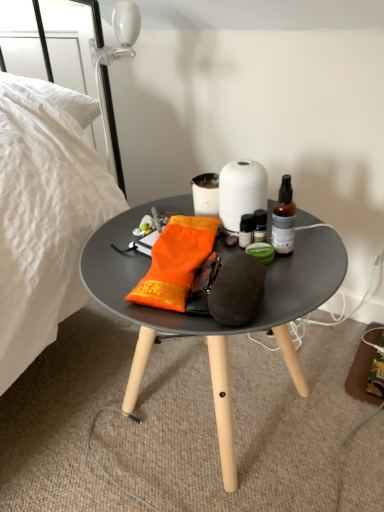
Question: Is orange fabric pouch at center oriented away from matte gray coffee table at center?

Choices:
 (A) yes
 (B) no

Answer: (B)

Question: Considering the relative positions of orange fabric pouch at center and matte gray coffee table at center in the image provided, is orange fabric pouch at center to the left of matte gray coffee table at center from the viewer's perspective?

Choices:
 (A) yes
 (B) no

Answer: (A)

Question: Is matte gray coffee table at center inside orange fabric pouch at center?

Choices:
 (A) yes
 (B) no

Answer: (B)

Question: Does orange fabric pouch at center have a greater height compared to matte gray coffee table at center?

Choices:
 (A) yes
 (B) no

Answer: (B)

Question: Is the depth of orange fabric pouch at center less than that of matte gray coffee table at center?

Choices:
 (A) yes
 (B) no

Answer: (B)

Question: In terms of height, does white matte vase at center look taller or shorter compared to matte gray coffee table at center?

Choices:
 (A) tall
 (B) short

Answer: (B)

Question: Which is correct: white matte vase at center is inside matte gray coffee table at center, or outside of it?

Choices:
 (A) outside
 (B) inside

Answer: (A)

Question: Visually, is white matte vase at center positioned to the left or to the right of matte gray coffee table at center?

Choices:
 (A) left
 (B) right

Answer: (B)

Question: From a real-world perspective, is white matte vase at center positioned above or below matte gray coffee table at center?

Choices:
 (A) below
 (B) above

Answer: (B)

Question: From a real-world perspective, is white matte vase at center above or below orange fabric pouch at center?

Choices:
 (A) below
 (B) above

Answer: (B)

Question: From the image's perspective, is white matte vase at center located above or below orange fabric pouch at center?

Choices:
 (A) above
 (B) below

Answer: (A)

Question: Considering their positions, is white matte vase at center located in front of or behind orange fabric pouch at center?

Choices:
 (A) front
 (B) behind

Answer: (B)

Question: Looking at the image, does white matte vase at center seem bigger or smaller compared to orange fabric pouch at center?

Choices:
 (A) big
 (B) small

Answer: (B)

Question: From the image's perspective, relative to brown glass bottle at center, is matte gray coffee table at center above or below?

Choices:
 (A) above
 (B) below

Answer: (B)

Question: Visually, is matte gray coffee table at center positioned to the left or to the right of brown glass bottle at center?

Choices:
 (A) left
 (B) right

Answer: (A)